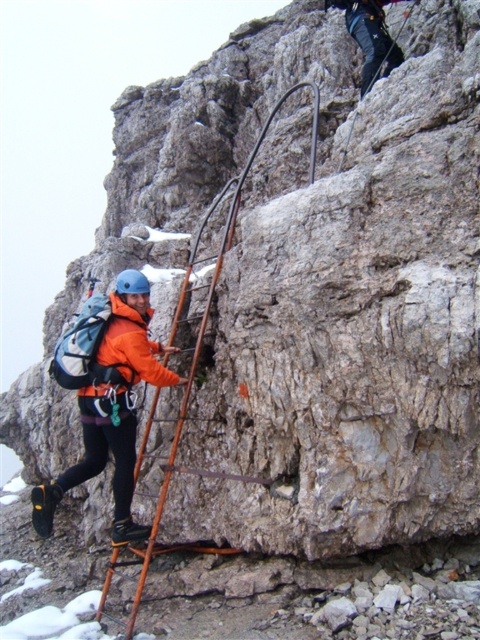
You are standing at the base of the rock face and see the orange fabric jacket at left worn by the climber. If you want to throw a rope to reach the climber, and your throwing range is 7 meters, will you be able to reach them?

The orange fabric jacket at left is 7.19 meters away from the viewer. Since your throwing range is 7 meters, you cannot reach the climber with the rope.

You are a photographer planning to capture the climber and the ladder in the image. You need to ensure that both the orange fabric jacket at left and the orange metal ladder at center are visible in your shot. Considering their sizes, which object should you focus on to frame the shot properly?

The orange metal ladder at center is wider than the orange fabric jacket at left, so you should focus on the orange metal ladder at center to ensure both objects are framed properly in the shot.

You are a hiker trying to locate the orange fabric jacket at left on a steep rock face. The coordinates given are in the range of 0 to 1 for both x and y axes. If the rock face is represented as a coordinate plane, with the bottom left corner as the origin, can you determine whether the orange fabric jacket at left is positioned higher or lower than the point at coordinate point (112, 406)?

The orange fabric jacket at left is located exactly at point (112, 406), so it is neither higher nor lower than that point.